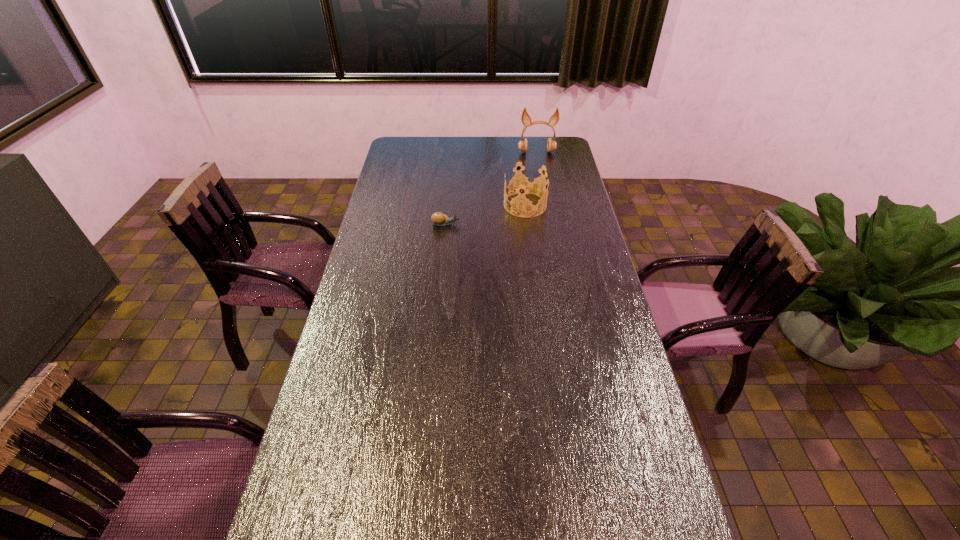
I want to click on earphone that is at the right edge, so click(x=525, y=118).

Find the location of a particular element. crown that is positioned at the right edge is located at coordinates click(x=526, y=185).

Identify the location of object located at the far right corner. This screenshot has height=540, width=960. (525, 118).

At what (x,y) coordinates should I click in order to perform the action: click on free space at the far edge of the desktop. Please return your answer as a coordinate pair (x, y). This screenshot has height=540, width=960. Looking at the image, I should click on (454, 155).

At what (x,y) coordinates should I click in order to perform the action: click on vacant area at the left edge of the desktop. Please return your answer as a coordinate pair (x, y). This screenshot has height=540, width=960. Looking at the image, I should click on (410, 224).

Locate an element on the screen. vacant point at the right edge is located at coordinates (570, 263).

This screenshot has height=540, width=960. What are the coordinates of `vacant region between the crown and the nearest object` in the screenshot? It's located at (486, 214).

Image resolution: width=960 pixels, height=540 pixels. Find the location of `vacant space in between the shortest object and the tallest object`. vacant space in between the shortest object and the tallest object is located at coordinates (492, 188).

Image resolution: width=960 pixels, height=540 pixels. In order to click on free spot between the escargot and the crown in this screenshot , I will do `click(486, 214)`.

This screenshot has width=960, height=540. In order to click on empty location between the shortest object and the second tallest object in this screenshot , I will do `click(486, 214)`.